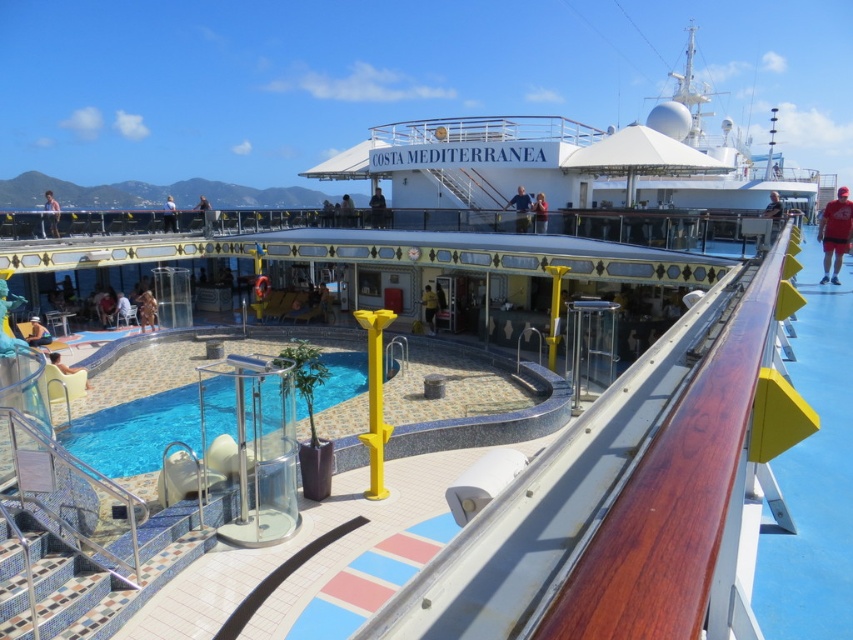
Question: Does brown leather jacket at lower left have a smaller size compared to smooth tan skin at lower left?

Choices:
 (A) no
 (B) yes

Answer: (A)

Question: Which of the following is the closest to the observer?

Choices:
 (A) (62, 369)
 (B) (544, 230)
 (C) (170, 225)
 (D) (86, 451)

Answer: (D)

Question: Which point is farther to the camera?

Choices:
 (A) red fabric shorts at right
 (B) light brown wooden chair at upper center

Answer: (B)

Question: Can you confirm if blue fabric shirt at upper center is positioned above yellow fabric person at center?

Choices:
 (A) no
 (B) yes

Answer: (B)

Question: Which object is the farthest from the matte blue shirt at upper center?

Choices:
 (A) blue fabric shirt at upper center
 (B) dark blue shirt at upper right
 (C) brown leather jacket at lower left
 (D) transparent glass pool at center

Answer: (C)

Question: Is matte black person at upper left below dark blue shirt at upper right?

Choices:
 (A) no
 (B) yes

Answer: (A)